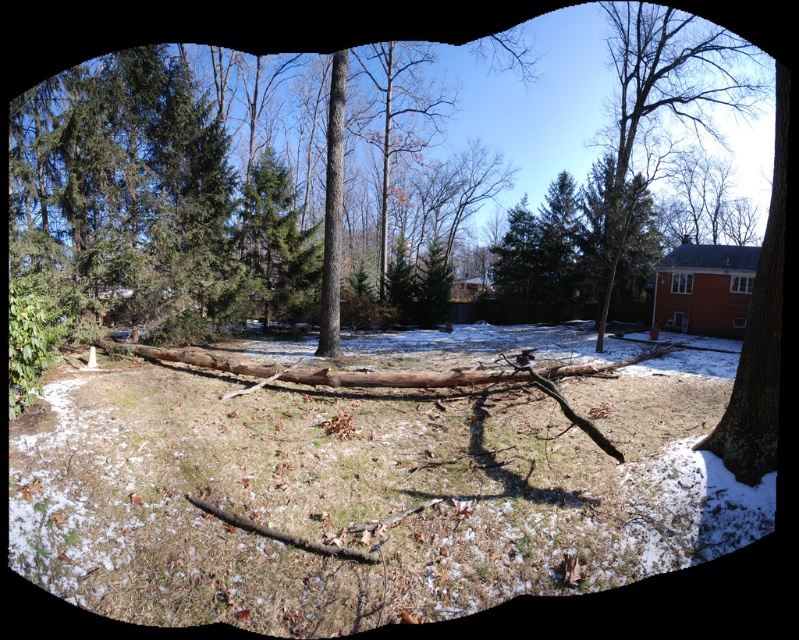
Question: Among these objects, which one is nearest to the camera?

Choices:
 (A) brown rough bark tree trunk at right
 (B) brown rough wood log at center

Answer: (B)

Question: Which is nearer to the brown rough tree at upper right?

Choices:
 (A) smooth brown tree trunk at center
 (B) brown rough bark tree trunk at right
 (C) brown rough wood log at center

Answer: (C)

Question: Can you confirm if brown rough wood log at center is positioned below brown rough tree at upper right?

Choices:
 (A) yes
 (B) no

Answer: (A)

Question: Does brown rough tree at upper right appear on the left side of smooth brown tree trunk at center?

Choices:
 (A) no
 (B) yes

Answer: (A)

Question: Can you confirm if brown rough tree at upper right is smaller than brown rough bark tree trunk at right?

Choices:
 (A) no
 (B) yes

Answer: (A)

Question: Which point is farther to the camera?

Choices:
 (A) smooth brown tree trunk at center
 (B) brown rough bark tree trunk at right
 (C) brown rough wood log at center

Answer: (A)